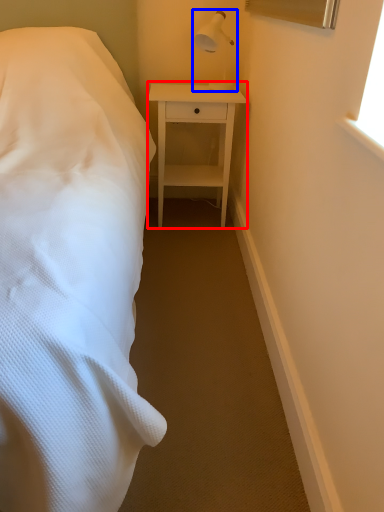
Question: Among these objects, which one is nearest to the camera, nightstand (highlighted by a red box) or bedside lamp (highlighted by a blue box)?

Choices:
 (A) nightstand
 (B) bedside lamp

Answer: (B)